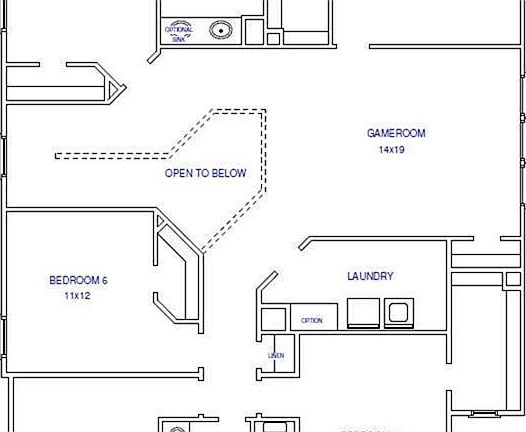
I want to click on laundry, so click(x=312, y=270).